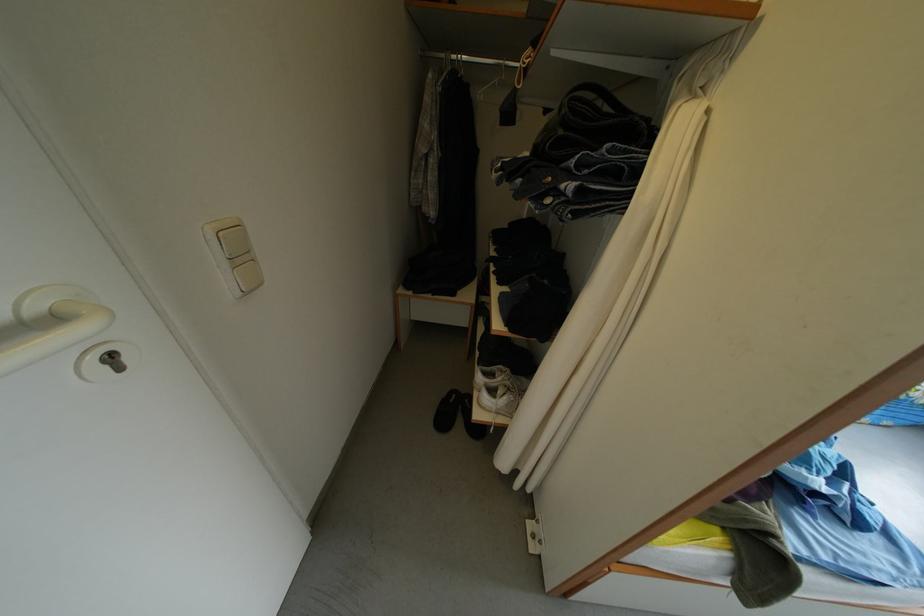
Where is `white door handle`? This screenshot has height=616, width=924. white door handle is located at coordinates (49, 313).